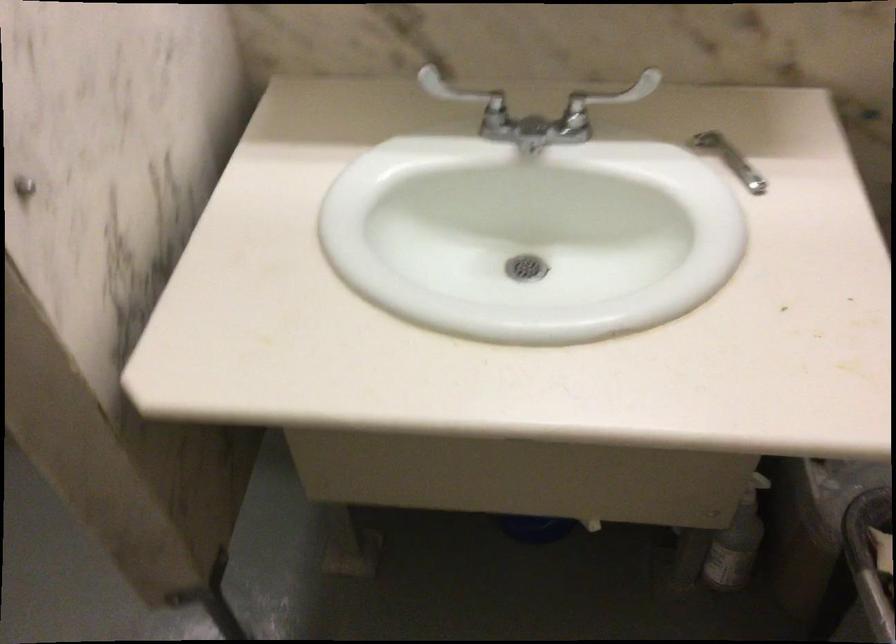
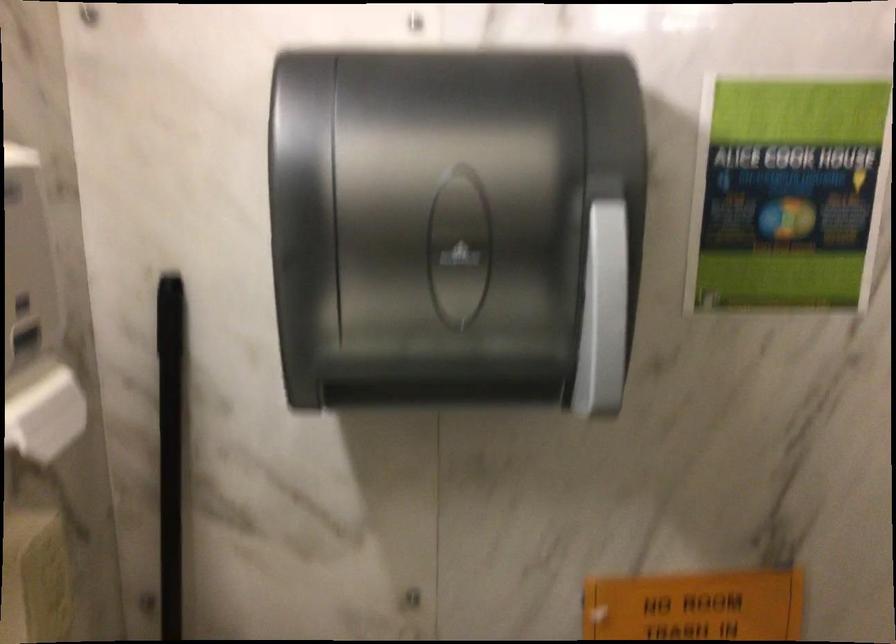
Question: How did the camera likely rotate?

Choices:
 (A) Left
 (B) Right
 (C) Up
 (D) Down

Answer: (B)